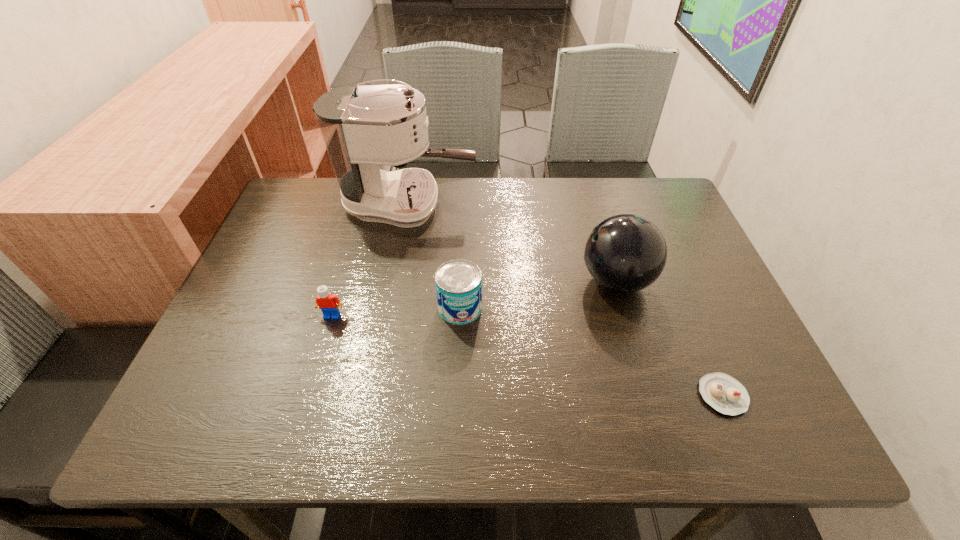
The width and height of the screenshot is (960, 540). Find the location of `free space located 0.270m on the side of the fourth shortest object with the finger holes`. free space located 0.270m on the side of the fourth shortest object with the finger holes is located at coordinates (466, 281).

You are a GUI agent. You are given a task and a screenshot of the screen. Output one action in this format:
    pyautogui.click(x=<x>, y=<y>)
    Task: Click on the vacant space positioned on the side of the fourth shortest object with the finger holes
    The height and width of the screenshot is (540, 960).
    Given the screenshot: What is the action you would take?
    pyautogui.click(x=428, y=281)

Find the location of a particular element. vacant space located 0.080m on the back of the can is located at coordinates (462, 267).

Find the location of a particular element. free space located on the face of the Lego is located at coordinates (313, 380).

Where is `vacant region located 0.080m on the left of the shortest object`? Image resolution: width=960 pixels, height=540 pixels. vacant region located 0.080m on the left of the shortest object is located at coordinates (657, 395).

I want to click on object that is positioned at the far edge, so click(x=364, y=128).

Identify the location of object that is at the near edge. This screenshot has height=540, width=960. (725, 394).

What are the coordinates of `bowling ball located at the right edge` in the screenshot? It's located at (625, 253).

Locate an element on the screen. The image size is (960, 540). cupcake located in the right edge section of the desktop is located at coordinates (725, 394).

At what (x,y) coordinates should I click in order to perform the action: click on object situated at the near right corner. Please return your answer as a coordinate pair (x, y). Looking at the image, I should click on (725, 394).